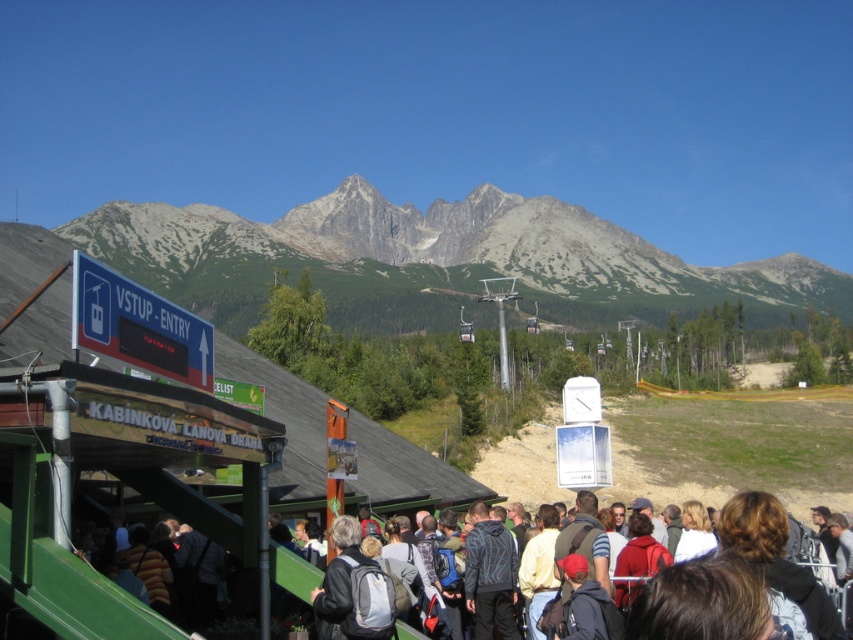
Can you confirm if green metal ski resort at center is bigger than dark gray backpack at center?

Correct, green metal ski resort at center is larger in size than dark gray backpack at center.

The height and width of the screenshot is (640, 853). What are the coordinates of `green metal ski resort at center` in the screenshot? It's located at (283, 422).

Is gray rocky mountain at upper center smaller than dark gray backpack at center?

No, gray rocky mountain at upper center is not smaller than dark gray backpack at center.

Where is `gray rocky mountain at upper center`? gray rocky mountain at upper center is located at coordinates (433, 257).

At what (x,y) coordinates should I click in order to perform the action: click on gray rocky mountain at upper center. Please return your answer as a coordinate pair (x, y). Looking at the image, I should click on (433, 257).

From the picture: Between gray rocky mountain at upper center and green metal ski resort at center, which one is positioned lower?

green metal ski resort at center is lower down.

Is gray rocky mountain at upper center above green metal ski resort at center?

Correct, gray rocky mountain at upper center is located above green metal ski resort at center.

Is point (482, 216) farther from viewer compared to point (355, 490)?

Yes, it is behind point (355, 490).

The width and height of the screenshot is (853, 640). In order to click on gray rocky mountain at upper center in this screenshot , I will do `click(433, 257)`.